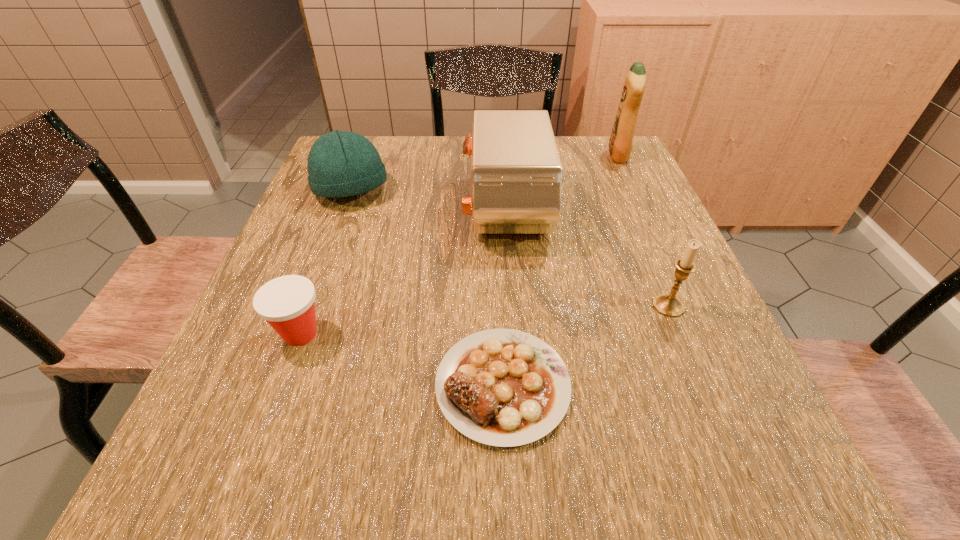
Find the location of a particular element. The image size is (960, 540). detergent is located at coordinates (621, 141).

The image size is (960, 540). I want to click on the farthest object, so click(x=621, y=141).

Find the location of a particular element. the second tallest object is located at coordinates (516, 174).

Identify the location of candle holder. The image size is (960, 540). (668, 304).

Where is `beanie`? beanie is located at coordinates (340, 163).

The width and height of the screenshot is (960, 540). I want to click on Dixie cup, so click(x=287, y=303).

Where is `the shortest object`? Image resolution: width=960 pixels, height=540 pixels. the shortest object is located at coordinates (501, 387).

Identify the location of blank space located on the label of the farthest object. point(587,156).

Find the location of a particular element. The image size is (960, 540). free location located on the label of the farthest object is located at coordinates (576, 156).

What are the coordinates of `vacant space located on the label of the farthest object` in the screenshot? It's located at (535, 156).